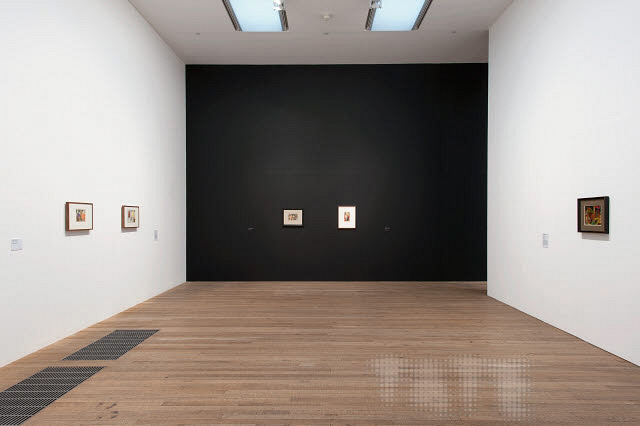
The image size is (640, 426). I want to click on 1 woden surface, so click(278, 393).